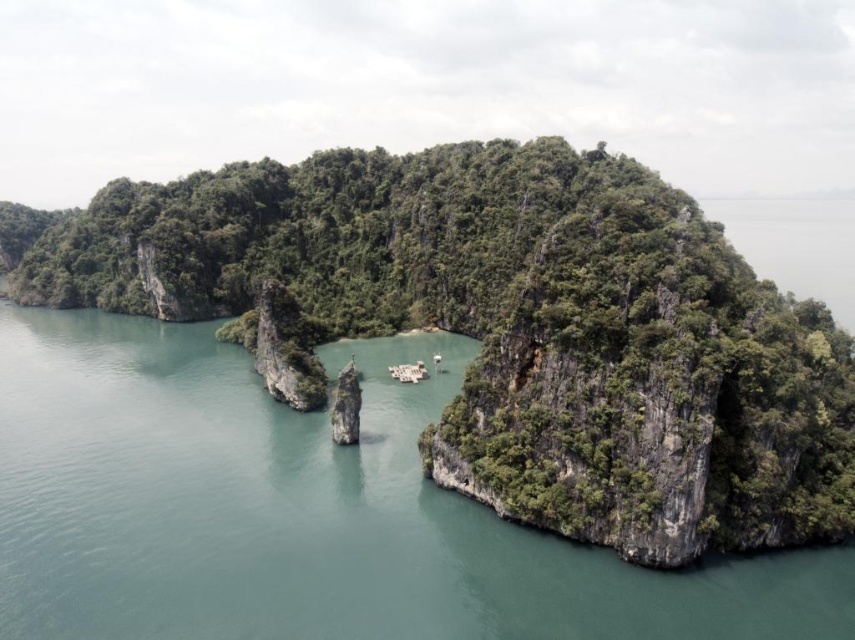
Question: Can you confirm if green leafy vegetation at center is positioned to the left of smooth gray rock at center?

Choices:
 (A) no
 (B) yes

Answer: (B)

Question: Is green leafy vegetation at center positioned at the back of smooth gray rock at center?

Choices:
 (A) no
 (B) yes

Answer: (A)

Question: Can you confirm if green leafy vegetation at center is positioned below smooth gray rock at center?

Choices:
 (A) no
 (B) yes

Answer: (A)

Question: Among these points, which one is nearest to the camera?

Choices:
 (A) (346, 417)
 (B) (491, 156)

Answer: (A)

Question: Which point appears farthest from the camera in this image?

Choices:
 (A) (352, 369)
 (B) (836, 348)

Answer: (A)